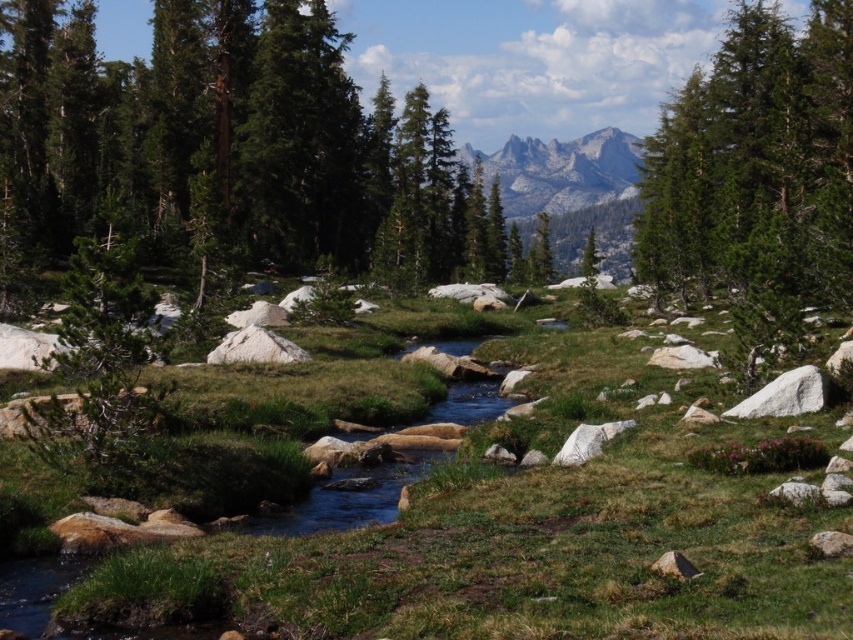
Question: Which of the following is the closest to the observer?

Choices:
 (A) (692, 257)
 (B) (523, 152)

Answer: (A)

Question: Can you confirm if green textured tree at upper right is positioned below gray rocky mountain at upper center?

Choices:
 (A) no
 (B) yes

Answer: (B)

Question: Which object is farther from the camera taking this photo?

Choices:
 (A) gray rocky mountain at upper center
 (B) green textured tree at upper right

Answer: (A)

Question: Is green textured tree at upper right wider than gray rocky mountain at upper center?

Choices:
 (A) no
 (B) yes

Answer: (B)

Question: In this image, where is green textured tree at upper right located relative to gray rocky mountain at upper center?

Choices:
 (A) below
 (B) above

Answer: (A)